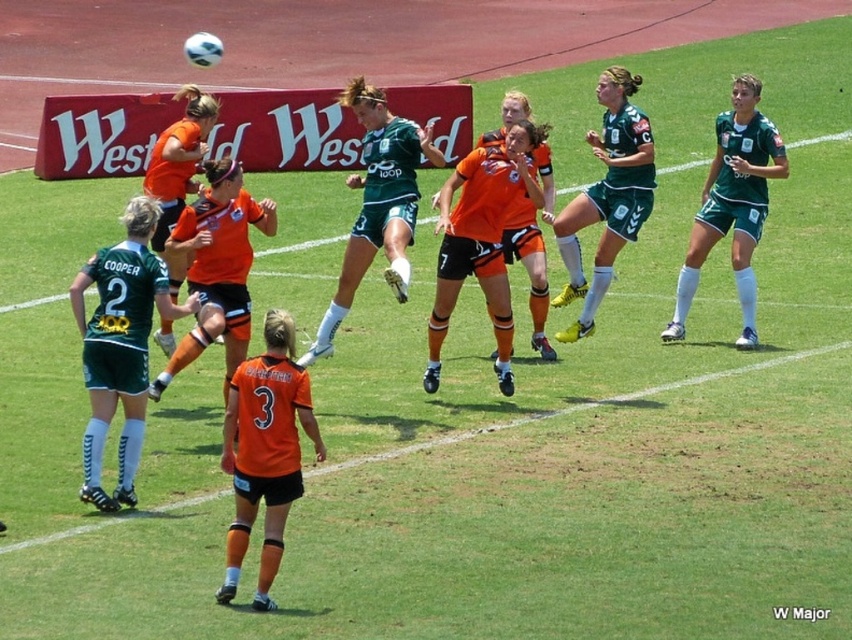
Can you confirm if matte green jersey at left is positioned to the right of green matte shorts at upper right?

In fact, matte green jersey at left is to the left of green matte shorts at upper right.

Identify the location of matte green jersey at left. (119, 346).

Does point (125, 432) come behind point (561, 209)?

No, it is not.

Identify the location of matte green jersey at left. (119, 346).

Is green jersey at center taller than orange jersey at center?

Indeed, green jersey at center has a greater height compared to orange jersey at center.

Does green jersey at center appear on the right side of orange jersey at center?

Correct, you'll find green jersey at center to the right of orange jersey at center.

Which is behind, point (360, 221) or point (194, 161)?

Point (194, 161)

Find the location of a particular element. green jersey at center is located at coordinates (377, 204).

Can you confirm if green matte shorts at upper right is wider than orange jersey at center?

Yes.

Is green matte shorts at upper right thinner than orange jersey at center?

No, green matte shorts at upper right is not thinner than orange jersey at center.

Locate an element on the screen. green matte shorts at upper right is located at coordinates (607, 196).